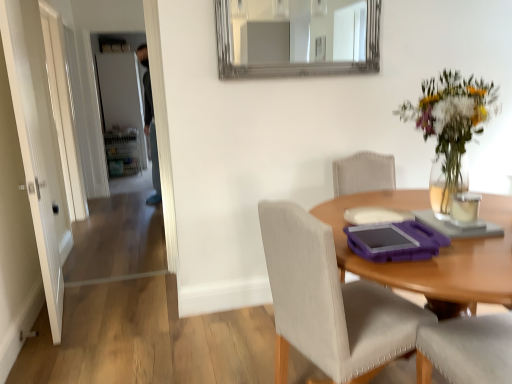
Question: Is silver-framed mirror at upper center positioned behind white matte door at upper left, the 2th door from the front?

Choices:
 (A) no
 (B) yes

Answer: (A)

Question: From a real-world perspective, is silver-framed mirror at upper center under white matte door at upper left, which ranks as the 1th door in back-to-front order?

Choices:
 (A) yes
 (B) no

Answer: (B)

Question: From the image's perspective, does silver-framed mirror at upper center appear lower than white matte door at upper left, the 2th door from the front?

Choices:
 (A) yes
 (B) no

Answer: (A)

Question: Can we say silver-framed mirror at upper center lies outside white matte door at upper left, the 1th door from the left?

Choices:
 (A) yes
 (B) no

Answer: (A)

Question: Does silver-framed mirror at upper center appear on the right side of white matte door at upper left, the 1th door from the left?

Choices:
 (A) yes
 (B) no

Answer: (A)

Question: Can you confirm if silver-framed mirror at upper center is wider than white matte door at upper left, which ranks as the 1th door in back-to-front order?

Choices:
 (A) yes
 (B) no

Answer: (B)

Question: From a real-world perspective, is translucent glass vase at upper right located beneath clear glass candle at upper right?

Choices:
 (A) yes
 (B) no

Answer: (B)

Question: Is translucent glass vase at upper right looking in the opposite direction of clear glass candle at upper right?

Choices:
 (A) no
 (B) yes

Answer: (A)

Question: Is translucent glass vase at upper right further to camera compared to clear glass candle at upper right?

Choices:
 (A) no
 (B) yes

Answer: (A)

Question: Is translucent glass vase at upper right directly adjacent to clear glass candle at upper right?

Choices:
 (A) no
 (B) yes

Answer: (A)

Question: Is translucent glass vase at upper right wider than clear glass candle at upper right?

Choices:
 (A) yes
 (B) no

Answer: (A)

Question: From a real-world perspective, is translucent glass vase at upper right positioned over clear glass candle at upper right based on gravity?

Choices:
 (A) yes
 (B) no

Answer: (A)

Question: From the image's perspective, is white glossy door at left, the first door in the right-to-left sequence, located beneath wooden table at center?

Choices:
 (A) no
 (B) yes

Answer: (A)